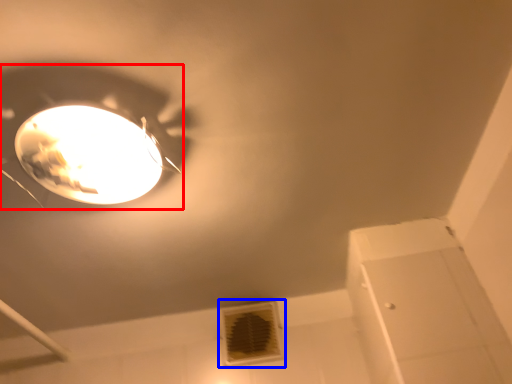
Question: Which of the following is the closest to the observer, lamp (highlighted by a red box) or air conditioning (highlighted by a blue box)?

Choices:
 (A) lamp
 (B) air conditioning

Answer: (A)